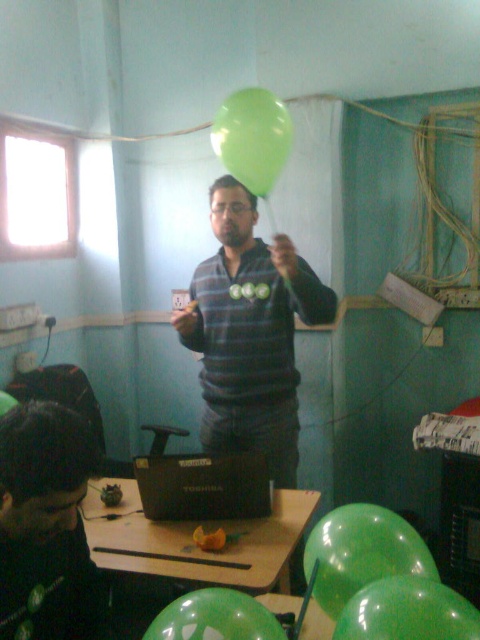
You are standing in the classroom and want to walk from point A to point B. Point A is located at coordinate point (283,106) and point B is at coordinate point (210,612). Which point is closer to you?

Point A is closer to you because it is further to the viewer than point B.

You are a photographer standing behind the table. You want to take a photo of the matte black laptop at center using your camera. Can you reach the camera from your current position without moving your feet?

The matte black laptop at center and camera are 1.57 meters apart. Since you are standing behind the table, the distance between you and the camera is 1.57 meters. If you can reach 1.57 meters without moving your feet, then yes, but typically, this distance might require a step forward. However, the question specifies reaching the camera, not the laptop. Assuming the camera is placed near the laptop, the distance might be manageable depending on your reach. But the given data states they are 1.57 meters, so

You are a student sitting at the back of the classroom. You notice the matte black laptop at center and the green rubber balloon at upper center. Which object is closer to the ceiling?

The green rubber balloon at upper center is closer to the ceiling because it is positioned above the matte black laptop at center.